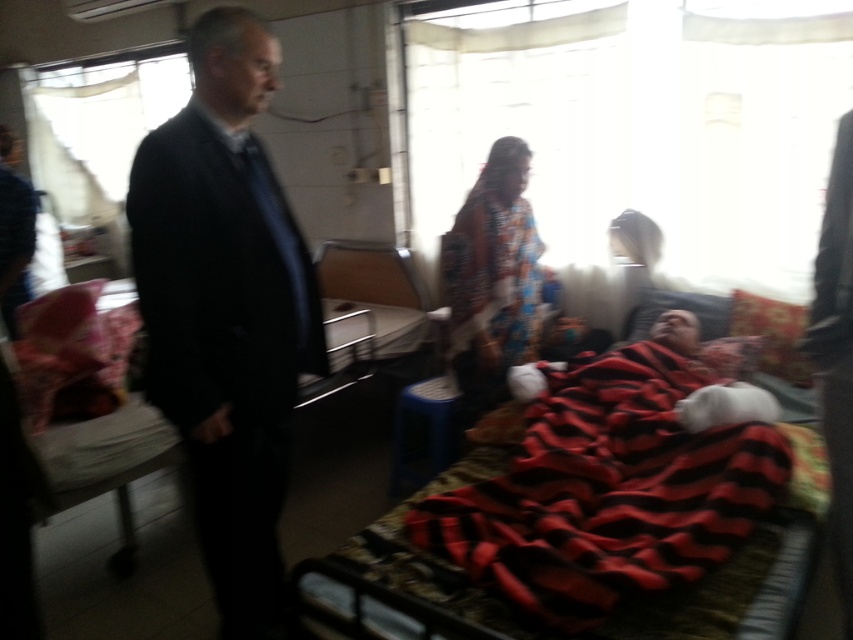
You are a healthcare professional entering the room and need to check the vital signs of the patient. The point where you need to place your stethoscope is at point (x=283, y=385). If your arm length is 0.7 meters, can you reach that point without moving closer?

The point (x=283, y=385) is 1.85 meters away from the camera. Since your arm length is only 0.7 meters, you cannot reach the point without moving closer.